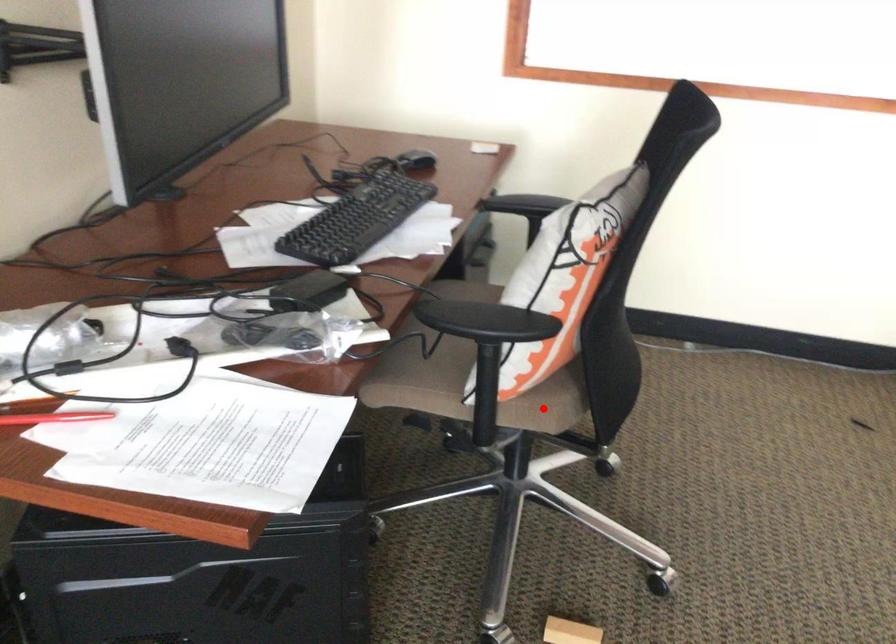
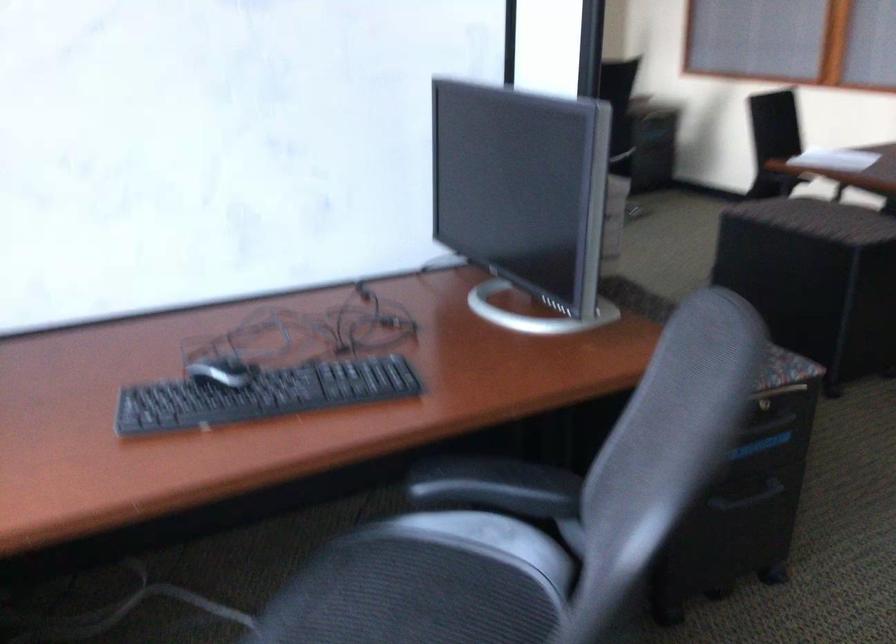
Question: I am providing you with two images of the same scene from different viewpoints. A red point is marked on the first image. Is the red point's position out of view in image 2?

Choices:
 (A) Yes
 (B) No

Answer: (A)